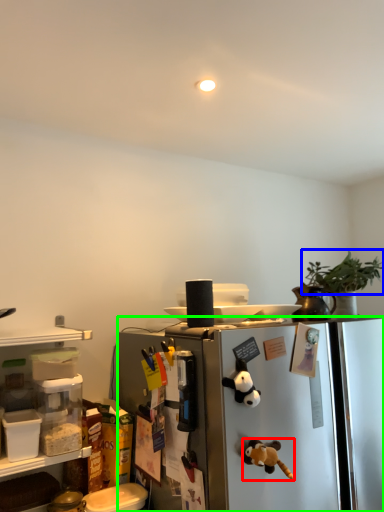
Question: Estimate the real-world distances between objects in this image. Which object is farther from toy (highlighted by a red box), plant (highlighted by a blue box) or refrigerator (highlighted by a green box)?

Choices:
 (A) plant
 (B) refrigerator

Answer: (A)